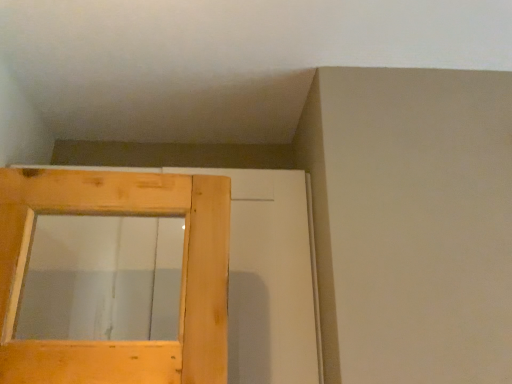
What do you see at coordinates (120, 215) in the screenshot? I see `wooden door at left` at bounding box center [120, 215].

I want to click on wooden door at left, so click(120, 215).

At what (x,y) coordinates should I click in order to perform the action: click on wooden door at left. Please return your answer as a coordinate pair (x, y). Image resolution: width=512 pixels, height=384 pixels. Looking at the image, I should click on (120, 215).